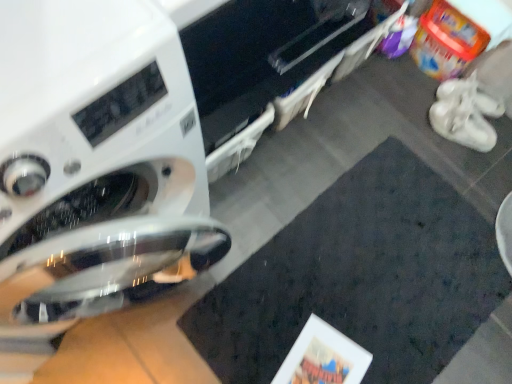
This screenshot has width=512, height=384. Find the location of `vacant area in front of white suede sneakers at right`. vacant area in front of white suede sneakers at right is located at coordinates (462, 171).